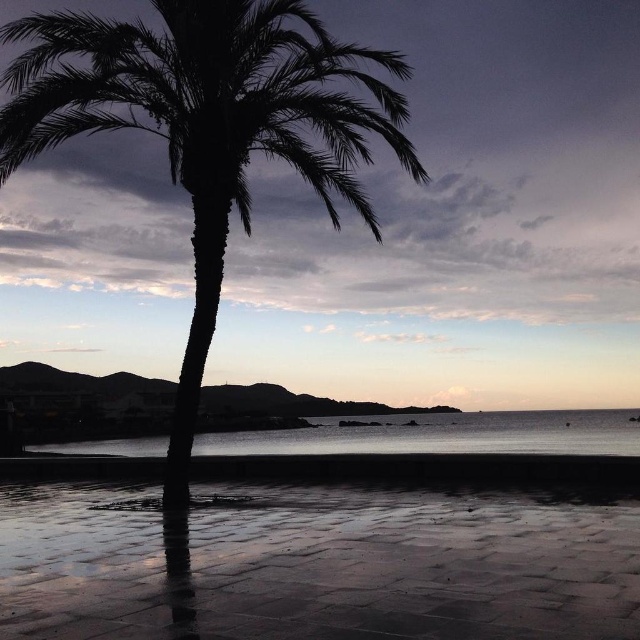
You are standing at the edge of the beach and want to walk from the reflective wet sand at lower center to the transparent water at center. Which surface will you step onto first?

You will step onto the reflective wet sand at lower center first because it has a lesser height compared to the transparent water at center, meaning it is lower and closer to your starting position.

You are a photographer trying to capture the silhouette leafy palm at center against the sky. However, you notice the reflective wet sand at lower center is causing glare. To avoid the glare, should you move the camera to the left or to the right of the palm tree?

Since the reflective wet sand at lower center is positioned under the silhouette leafy palm at center, moving the camera to the right of the palm tree would position it away from the reflective area, reducing glare. Moving to the left might keep the glare in the frame.